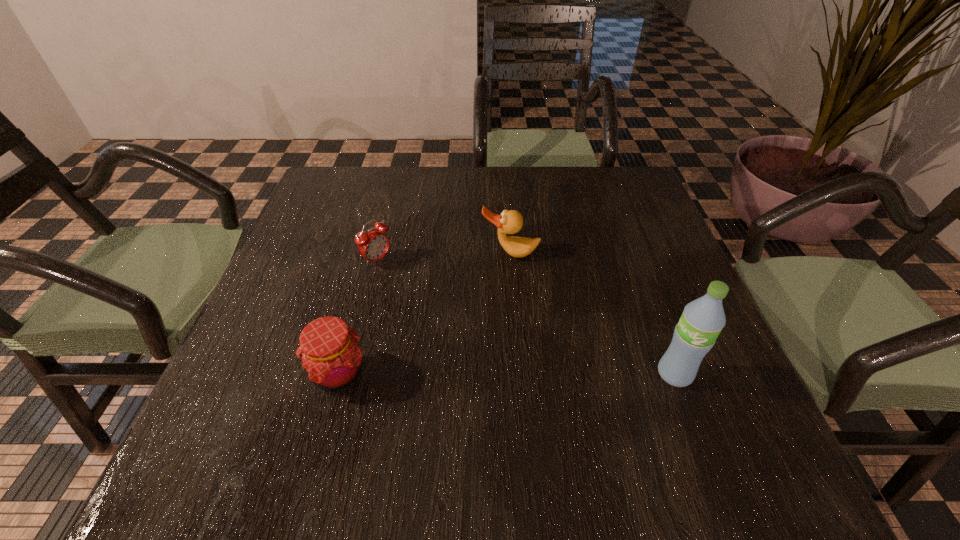
Find the location of `vacant region located on the face of the alarm clock`. vacant region located on the face of the alarm clock is located at coordinates (468, 325).

I want to click on vacant space located on the face of the alarm clock, so click(x=443, y=307).

Where is `vacant area situated 0.200m on the face of the alarm clock`? This screenshot has width=960, height=540. vacant area situated 0.200m on the face of the alarm clock is located at coordinates (449, 312).

Image resolution: width=960 pixels, height=540 pixels. In order to click on jam located at the near edge in this screenshot , I will do `click(329, 350)`.

Where is `water bottle at the near edge`? water bottle at the near edge is located at coordinates (702, 320).

Where is `object that is at the left edge`? object that is at the left edge is located at coordinates (329, 350).

The image size is (960, 540). Find the location of `object at the right edge`. object at the right edge is located at coordinates (702, 320).

The image size is (960, 540). I want to click on object that is at the near left corner, so click(x=329, y=350).

You are a GUI agent. You are given a task and a screenshot of the screen. Output one action in this format:
    pyautogui.click(x=<x>, y=<y>)
    Task: Click on the object present at the near right corner
    The width and height of the screenshot is (960, 540).
    Given the screenshot: What is the action you would take?
    pyautogui.click(x=702, y=320)

Identify the location of free space at the far edge of the desktop. (466, 173).